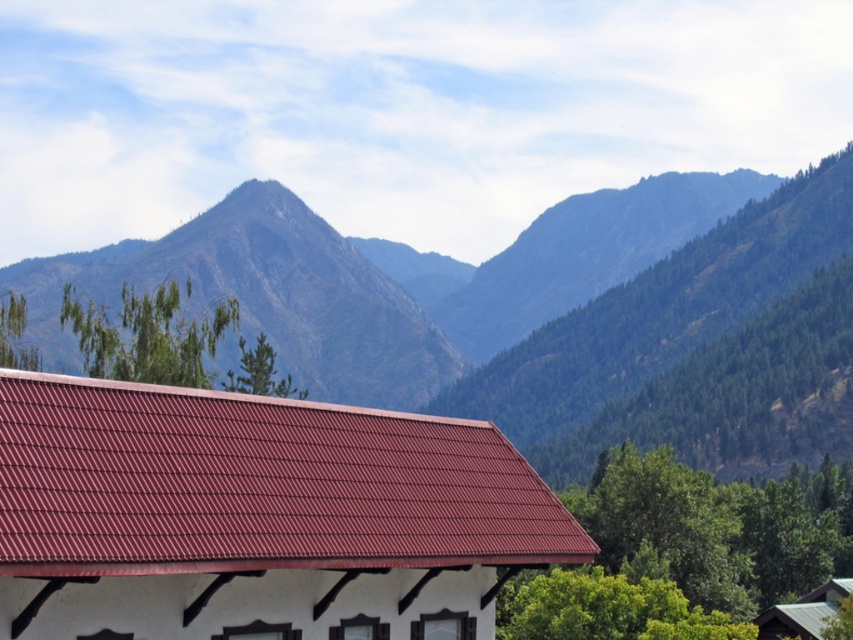
In the scene shown: You are an artist planning to paint the mountains in the image. You want to focus on the closest mountain first. Which one should you paint first, the green textured mountain at upper center or the rugged granite peak at upper center?

The green textured mountain at upper center is closer to the viewer than the rugged granite peak at upper center, so you should paint the green textured mountain at upper center first.

You are an architect designing a new structure that must fit within the visual balance of the scene. Considering the green textured mountain at upper center and the metallic gray hut at lower right, which object has a greater width and why?

The green textured mountain at upper center has a greater width than the metallic gray hut at lower right because its width surpasses that of the metallic gray hut, as stated in the description.

In the scene shown: You are a hiker standing at the base of the green textured mountain at upper center. You want to reach the summit, which is 898.90 feet away. If your average hiking pace is 3 feet per minute, how many minutes will it take you to reach the summit?

To reach the summit of the green textured mountain at upper center, which is 898.90 feet away at a pace of 3 feet per minute, it would take approximately 299.63 minutes. This is calculated by dividing the total distance by the pace per minute.